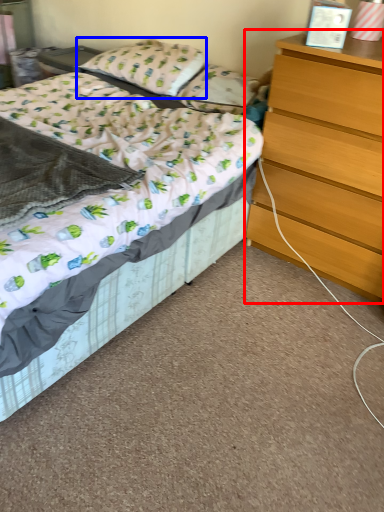
Question: Which object is further to the camera taking this photo, chest of drawers (highlighted by a red box) or pillow (highlighted by a blue box)?

Choices:
 (A) chest of drawers
 (B) pillow

Answer: (B)